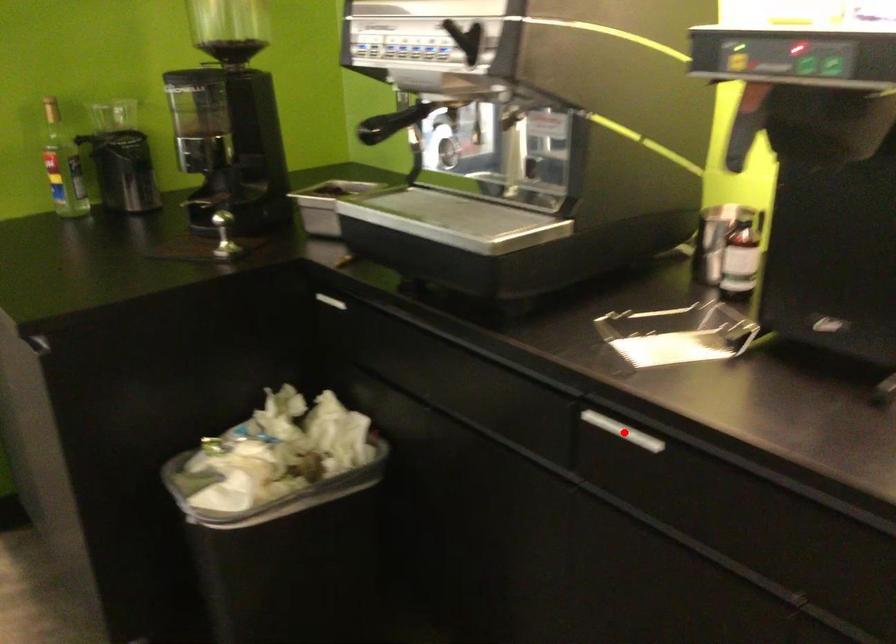
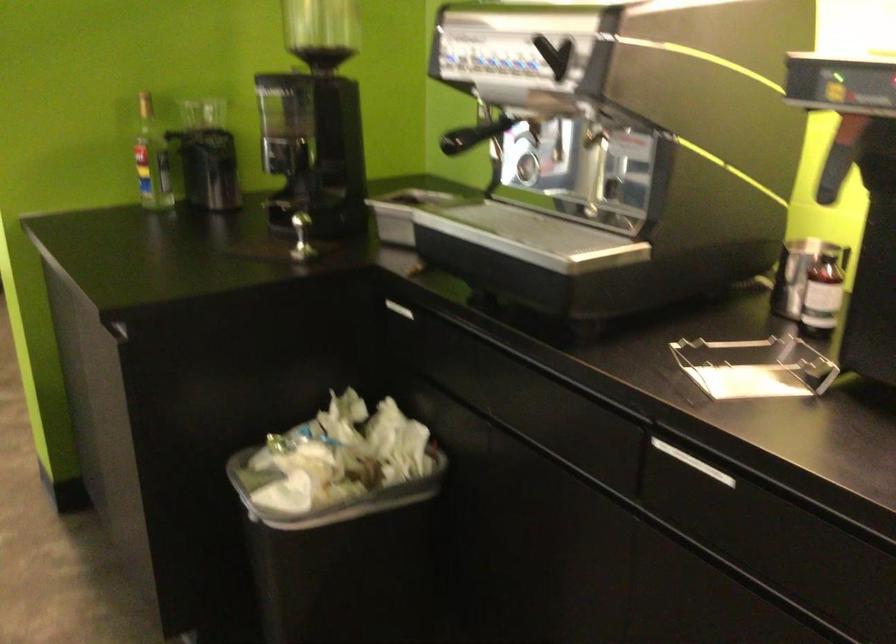
Where in the second image is the point corresponding to the highlighted location from the first image?

(693, 462)